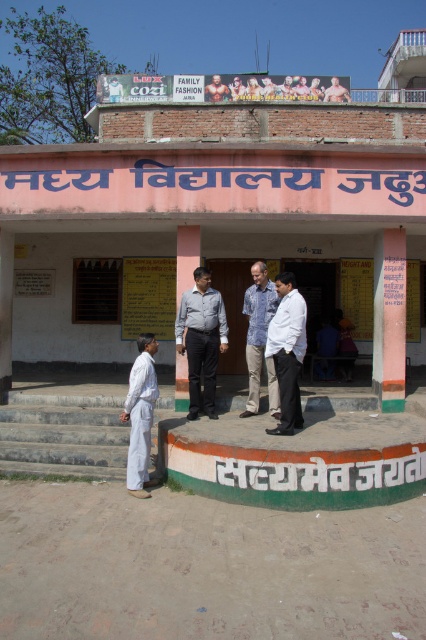
You are a painter who needs to paint a white painted wall at center and a white cotton shirt at lower left. Which object requires more vertical space to paint?

The white painted wall at center requires more vertical space to paint because it is much taller than the white cotton shirt at lower left.

You are standing at the entrance of the building and looking towards the porch. There are two points marked on the right side of the porch. Which point is closer to you, point [336,234] or point [152,369]?

Point [152,369] is closer to you because it is less further to the camera than point [336,234].

You are a visitor at the school entrance. You see the white glossy shirt at center and the matte gray pillar at center. Which object is taller?

The white glossy shirt at center is much taller than the matte gray pillar at center.